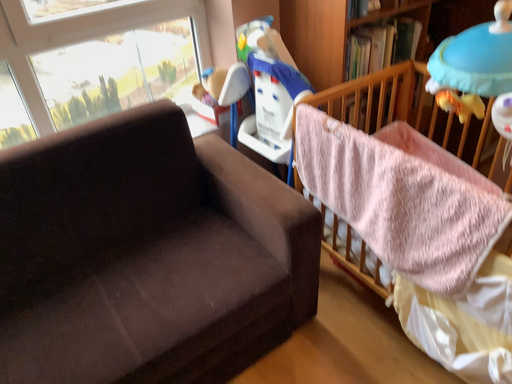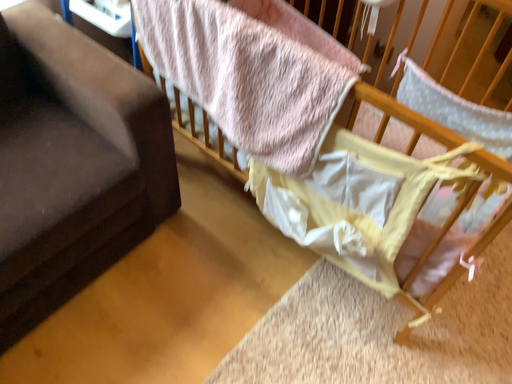
Question: Which way did the camera rotate in the video?

Choices:
 (A) rotated left
 (B) rotated right

Answer: (B)